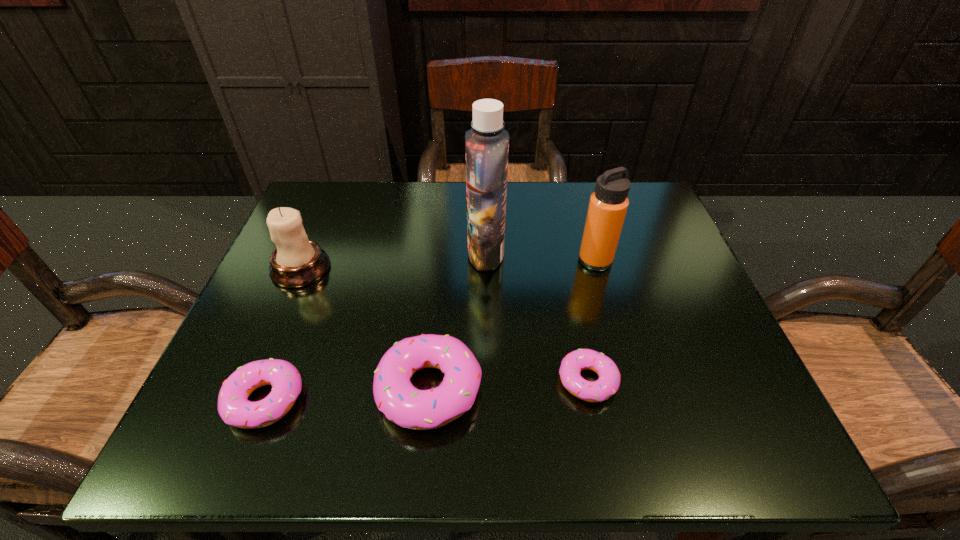
Identify the location of vacant position located 0.190m on the back of the third shortest object. This screenshot has width=960, height=540. (440, 275).

This screenshot has height=540, width=960. In order to click on vacant position located on the left of the shortest doughnut in this screenshot , I will do `click(369, 381)`.

This screenshot has height=540, width=960. Find the location of `free space located 0.170m on the back of the fourth shortest object`. free space located 0.170m on the back of the fourth shortest object is located at coordinates (327, 205).

This screenshot has height=540, width=960. I want to click on free point located on the front label of the shampoo, so click(422, 253).

Find the location of a particular element. This screenshot has height=540, width=960. vacant area located on the front label of the shampoo is located at coordinates (342, 253).

At what (x,y) coordinates should I click in order to perform the action: click on free space located 0.130m on the front label of the shampoo. Please return your answer as a coordinate pair (x, y). The height and width of the screenshot is (540, 960). Looking at the image, I should click on (409, 253).

I want to click on free space located on the left of the thermos bottle, so (468, 260).

Where is `object that is at the far edge`? object that is at the far edge is located at coordinates click(x=487, y=143).

Image resolution: width=960 pixels, height=540 pixels. I want to click on doughnut at the left edge, so click(x=235, y=409).

Locate an element on the screen. candle holder present at the left edge is located at coordinates (297, 261).